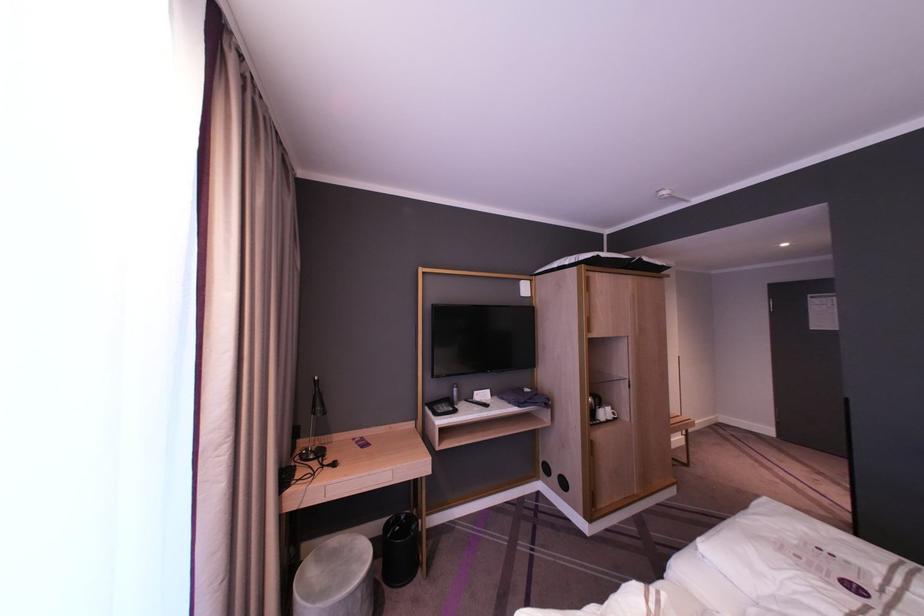
The height and width of the screenshot is (616, 924). What do you see at coordinates (441, 407) in the screenshot? I see `the telephone handset` at bounding box center [441, 407].